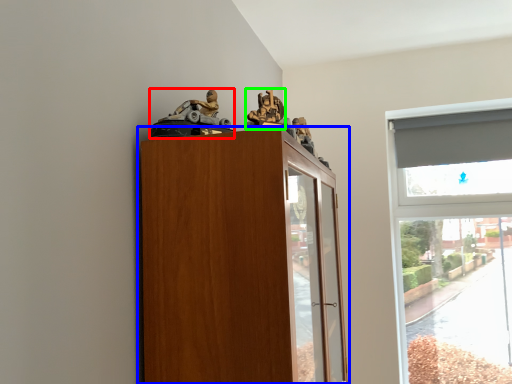
Question: Which object is positioned closest to toy (highlighted by a red box)? Select from cupboard (highlighted by a blue box) and toy (highlighted by a green box).

Choices:
 (A) cupboard
 (B) toy

Answer: (B)